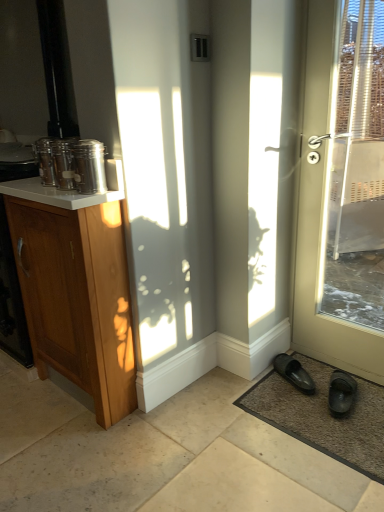
I want to click on unoccupied region to the right of black rubber slipper at lower right, the 1th footwear when ordered from left to right, so click(326, 372).